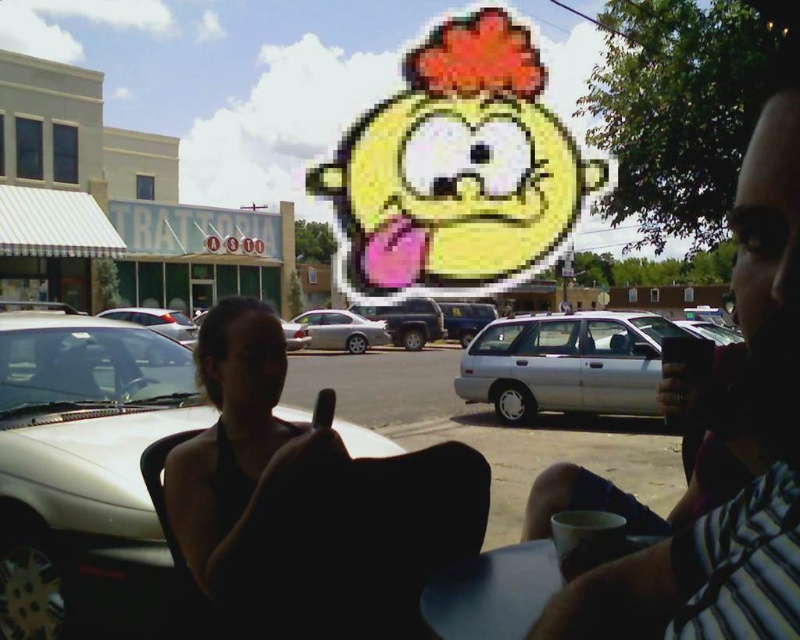
Looking at this image, who is positioned more to the right, white matte car at left or satin silver sedan at center?

Positioned to the right is satin silver sedan at center.

Consider the image. Who is higher up, white matte car at left or satin silver sedan at center?

white matte car at left is above.

Is point (162, 616) behind point (384, 323)?

No, it is not.

Where is `white matte car at left`? This screenshot has width=800, height=640. white matte car at left is located at coordinates (86, 474).

Is white matte car at left to the left of silver metallic station wagon at center from the viewer's perspective?

Correct, you'll find white matte car at left to the left of silver metallic station wagon at center.

Does point (136, 508) lie behind point (672, 323)?

That is False.

Between point (164, 620) and point (574, 326), which one is positioned in front?

Point (164, 620)

Where is `white matte car at left`? white matte car at left is located at coordinates (86, 474).

Between silver metallic station wagon at center and blue matte table at lower center, which one has less height?

With less height is blue matte table at lower center.

Which is more to the right, silver metallic station wagon at center or blue matte table at lower center?

silver metallic station wagon at center

Who is more forward, (486, 400) or (648, 541)?

Point (648, 541) is in front.

The image size is (800, 640). I want to click on silver metallic station wagon at center, so [x=566, y=364].